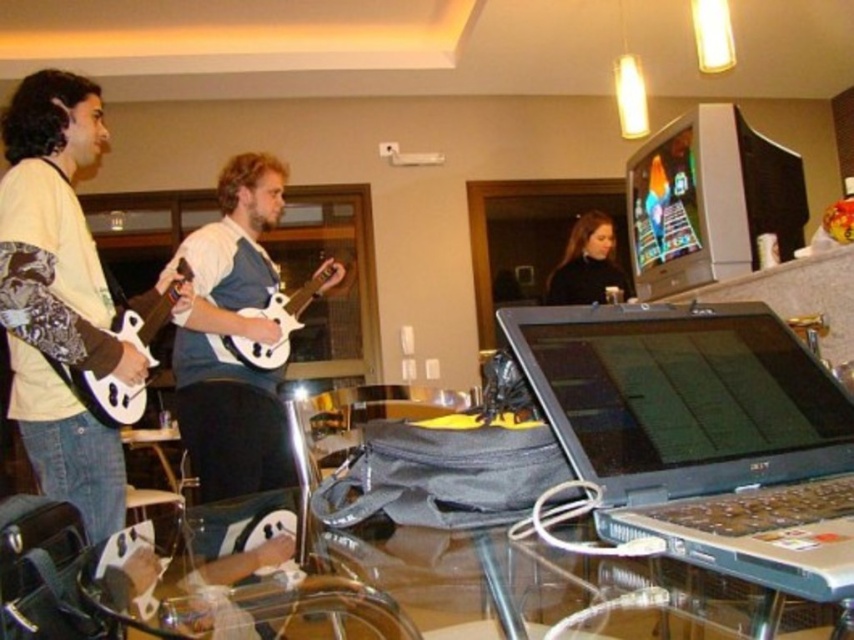
Which is above, white matte electric guitar at left or dark brown hair at center?

Positioned higher is dark brown hair at center.

Is white matte electric guitar at left to the left of dark brown hair at center from the viewer's perspective?

Correct, you'll find white matte electric guitar at left to the left of dark brown hair at center.

Find the location of a particular element. This screenshot has height=640, width=854. white matte electric guitar at left is located at coordinates (104, 394).

Who is shorter, silver metallic laptop at lower right or dark brown hair at center?

silver metallic laptop at lower right is shorter.

Is silver metallic laptop at lower right below dark brown hair at center?

Yes.

Is point (728, 493) farther from viewer compared to point (572, 228)?

That is False.

Image resolution: width=854 pixels, height=640 pixels. Identify the location of silver metallic laptop at lower right. coord(700,435).

Is point (581, 266) positioned after point (227, 349)?

Yes, it is behind point (227, 349).

This screenshot has height=640, width=854. Identify the location of dark brown hair at center. (586, 262).